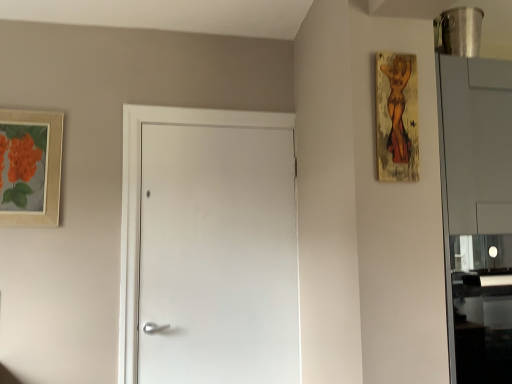
Question: From the image's perspective, would you say wooden textured painting at upper right, marked as the 2th picture frame in a back-to-front arrangement, is positioned over matte wooden picture frame at upper left, acting as the second picture frame starting from the right?

Choices:
 (A) no
 (B) yes

Answer: (B)

Question: Does wooden textured painting at upper right, marked as the 2th picture frame in a back-to-front arrangement, have a greater height compared to matte wooden picture frame at upper left, the first picture frame positioned from the back?

Choices:
 (A) no
 (B) yes

Answer: (A)

Question: Can you confirm if wooden textured painting at upper right, marked as the first picture frame in a right-to-left arrangement, is shorter than matte wooden picture frame at upper left, the first picture frame positioned from the back?

Choices:
 (A) yes
 (B) no

Answer: (A)

Question: Can you see wooden textured painting at upper right, marked as the first picture frame in a right-to-left arrangement, touching matte wooden picture frame at upper left, acting as the second picture frame starting from the right?

Choices:
 (A) no
 (B) yes

Answer: (A)

Question: From a real-world perspective, is wooden textured painting at upper right, marked as the 2th picture frame in a back-to-front arrangement, positioned over matte wooden picture frame at upper left, acting as the second picture frame starting from the right, based on gravity?

Choices:
 (A) no
 (B) yes

Answer: (B)

Question: Can you confirm if wooden textured painting at upper right, marked as the 2th picture frame in a back-to-front arrangement, is bigger than matte wooden picture frame at upper left, the second picture frame when ordered from front to back?

Choices:
 (A) yes
 (B) no

Answer: (B)

Question: Is matte wooden picture frame at upper left, the first picture frame positioned from the back, bigger than white matte door at center?

Choices:
 (A) no
 (B) yes

Answer: (A)

Question: Are matte wooden picture frame at upper left, acting as the second picture frame starting from the right, and white matte door at center beside each other?

Choices:
 (A) yes
 (B) no

Answer: (B)

Question: From the image's perspective, does matte wooden picture frame at upper left, the second picture frame when ordered from front to back, appear higher than white matte door at center?

Choices:
 (A) no
 (B) yes

Answer: (B)

Question: From the image's perspective, would you say matte wooden picture frame at upper left, acting as the second picture frame starting from the right, is shown under white matte door at center?

Choices:
 (A) no
 (B) yes

Answer: (A)

Question: Is the depth of matte wooden picture frame at upper left, acting as the second picture frame starting from the right, greater than that of white matte door at center?

Choices:
 (A) no
 (B) yes

Answer: (A)

Question: Is matte wooden picture frame at upper left, the first picture frame positioned from the back, closer to camera compared to white matte door at center?

Choices:
 (A) no
 (B) yes

Answer: (B)

Question: Can you confirm if white matte door at center is taller than wooden textured painting at upper right, marked as the first picture frame in a right-to-left arrangement?

Choices:
 (A) no
 (B) yes

Answer: (B)